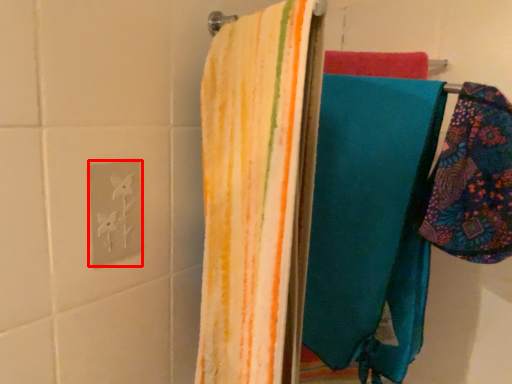
Question: From the image's perspective, what is the correct spatial positioning of electric outlet (annotated by the red box) in reference to towel?

Choices:
 (A) above
 (B) below

Answer: (B)